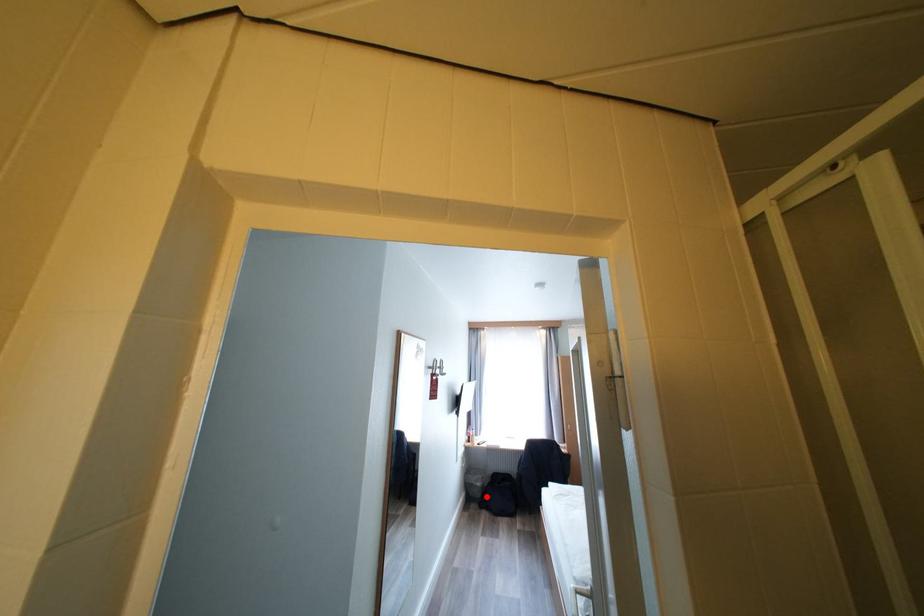
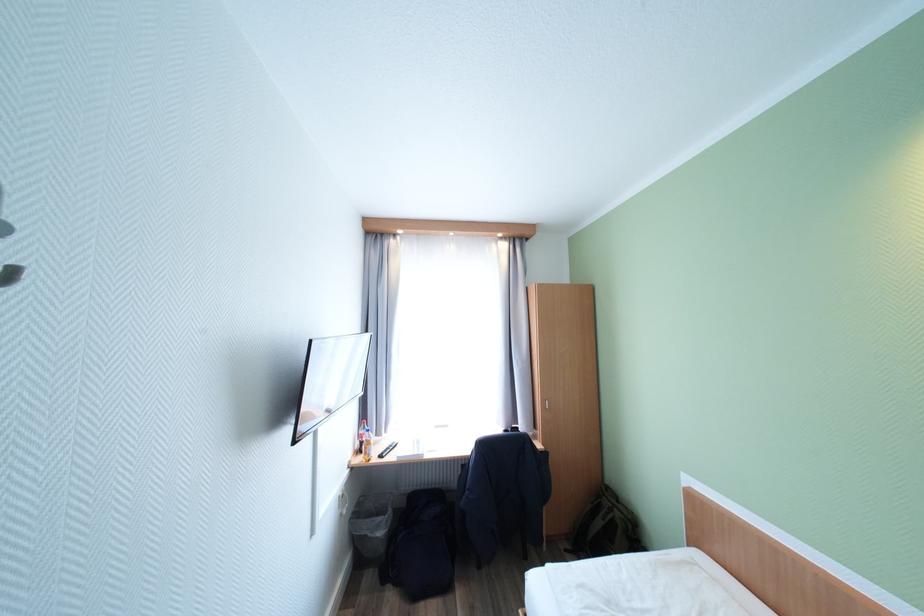
The point at the highlighted location is marked in the first image. Where is the corresponding point in the second image?

(390, 551)